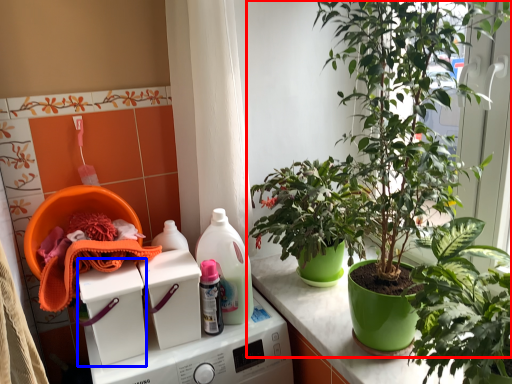
Question: Which of the following is the closest to the observer, houseplant (highlighted by a red box) or washing machine (highlighted by a blue box)?

Choices:
 (A) houseplant
 (B) washing machine

Answer: (A)